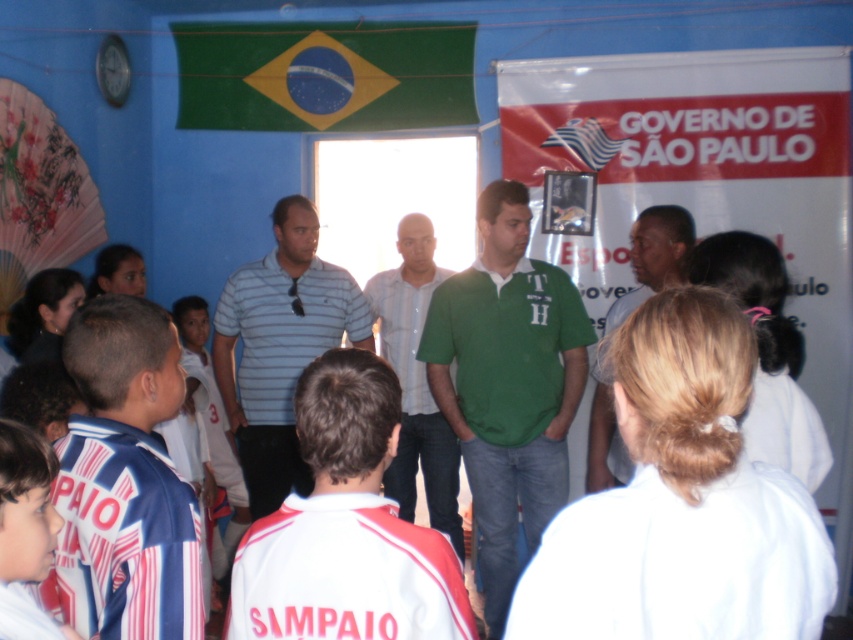
From the picture: You are organizing a photo shoot and need to position two models wearing the green cotton shirt at center and dark green shirt at center. The camera is placed at the back of the room where the speakers are standing. Can you fit both models within a 6 feet wide frame without overlapping?

The distance between the green cotton shirt at center and dark green shirt at center is 5.09 feet, which is less than 6 feet. Therefore, both models can be positioned within the 6 feet wide frame without overlapping.

You are attending a presentation in the room described. You need to locate both the green fabric flag at upper center and the light blue striped polo shirt at center. From your perspective facing the front of the room, which object is on the right side?

The green fabric flag at upper center is positioned on the right side of the light blue striped polo shirt at center, so from your perspective facing the front, the green fabric flag at upper center would be on the right side.

You are attending a meeting in a room with blue walls and a Brazilian flag. You notice two men at the center wearing shirts labeled as green cotton shirt at center and dark green shirt at center. Which of these shirts is smaller in size?

The green cotton shirt at center is smaller in size compared to the dark green shirt at center.